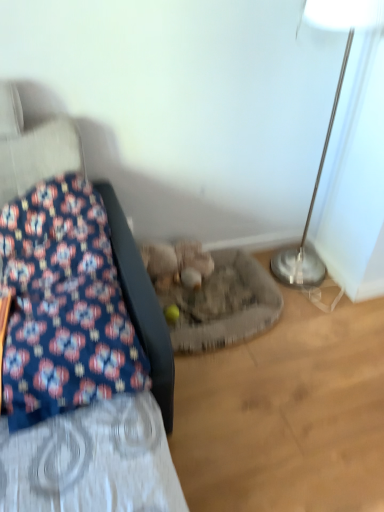
I want to click on fluffy beige stuffed animal at center, so click(177, 263).

From a real-world perspective, who is located lower, fluffy beige stuffed animal at center or blue floral fabric at left?

From a 3D spatial view, fluffy beige stuffed animal at center is below.

Is blue floral fabric at left located within fluffy beige stuffed animal at center?

No, blue floral fabric at left is not a part of fluffy beige stuffed animal at center.

Which of these two, fluffy beige stuffed animal at center or blue floral fabric at left, is wider?

Wider between the two is blue floral fabric at left.

Could you tell me if fluffy beige stuffed animal at center is turned towards blue floral fabric at left?

No, fluffy beige stuffed animal at center is not turned towards blue floral fabric at left.

Which object is positioned more to the right, fluffy beige stuffed animal at center or silver metallic floor lamp at right?

From the viewer's perspective, silver metallic floor lamp at right appears more on the right side.

Who is smaller, fluffy beige stuffed animal at center or silver metallic floor lamp at right?

Smaller between the two is fluffy beige stuffed animal at center.

Is fluffy beige stuffed animal at center not near silver metallic floor lamp at right?

Actually, fluffy beige stuffed animal at center and silver metallic floor lamp at right are a little close together.

From the image's perspective, does fluffy beige stuffed animal at center appear higher than silver metallic floor lamp at right?

No, from the image's perspective, fluffy beige stuffed animal at center is not over silver metallic floor lamp at right.

Where is `lamp above the blue floral fabric at left (from a real-world perspective)`? The image size is (384, 512). lamp above the blue floral fabric at left (from a real-world perspective) is located at coordinates (328, 124).

How many degrees apart are the facing directions of blue floral fabric at left and silver metallic floor lamp at right?

They differ by 91 degrees in their facing directions.

Who is smaller, blue floral fabric at left or silver metallic floor lamp at right?

With smaller size is blue floral fabric at left.

In the scene shown: From the image's perspective, is blue floral fabric at left positioned above or below silver metallic floor lamp at right?

From the image's perspective, blue floral fabric at left appears below silver metallic floor lamp at right.

Image resolution: width=384 pixels, height=512 pixels. I want to click on furniture that is on the left side of fluffy beige stuffed animal at center, so click(x=142, y=306).

From the image's perspective, which is above, blue floral fabric at left or fluffy beige stuffed animal at center?

fluffy beige stuffed animal at center appears higher in the image.

From the image's perspective, is silver metallic floor lamp at right on fluffy beige stuffed animal at center?

Yes, from the image's perspective, silver metallic floor lamp at right is over fluffy beige stuffed animal at center.

Locate an element on the screen. The height and width of the screenshot is (512, 384). lamp on the right side of fluffy beige stuffed animal at center is located at coordinates (328, 124).

Based on the photo, considering the sizes of objects silver metallic floor lamp at right and fluffy beige stuffed animal at center in the image provided, who is shorter, silver metallic floor lamp at right or fluffy beige stuffed animal at center?

fluffy beige stuffed animal at center.

Is silver metallic floor lamp at right further to the viewer compared to fluffy beige stuffed animal at center?

No, silver metallic floor lamp at right is closer to the viewer.

Could you tell me if silver metallic floor lamp at right is facing blue floral fabric at left?

Yes, silver metallic floor lamp at right is turned towards blue floral fabric at left.

Does point (304, 13) lie in front of point (164, 390)?

No.

Would you say silver metallic floor lamp at right is outside blue floral fabric at left?

Yes.

Consider the image. Can you confirm if silver metallic floor lamp at right is shorter than blue floral fabric at left?

No, silver metallic floor lamp at right is not shorter than blue floral fabric at left.

The image size is (384, 512). There is a fluffy beige stuffed animal at center. Find the location of `furniture above it (from a real-world perspective)`. furniture above it (from a real-world perspective) is located at coordinates (142, 306).

The width and height of the screenshot is (384, 512). I want to click on animal behind the silver metallic floor lamp at right, so pyautogui.click(x=177, y=263).

When comparing their distances from silver metallic floor lamp at right, does blue floral fabric at left or fluffy beige stuffed animal at center seem further?

Based on the image, blue floral fabric at left appears to be further to silver metallic floor lamp at right.

Looking at this image, looking at the image, which one is located further to fluffy beige stuffed animal at center, silver metallic floor lamp at right or blue floral fabric at left?

The object further to fluffy beige stuffed animal at center is silver metallic floor lamp at right.

When comparing their distances from silver metallic floor lamp at right, does fluffy beige stuffed animal at center or blue floral fabric at left seem further?

blue floral fabric at left lies further to silver metallic floor lamp at right than the other object.

Considering their positions, is fluffy beige stuffed animal at center positioned further to blue floral fabric at left than silver metallic floor lamp at right?

silver metallic floor lamp at right is positioned further to the anchor blue floral fabric at left.

Based on their spatial positions, is silver metallic floor lamp at right or fluffy beige stuffed animal at center further from blue floral fabric at left?

Based on the image, silver metallic floor lamp at right appears to be further to blue floral fabric at left.

Consider the image. From the image, which object appears to be nearer to fluffy beige stuffed animal at center, blue floral fabric at left or silver metallic floor lamp at right?

blue floral fabric at left.

What are the coordinates of `lamp located between blue floral fabric at left and fluffy beige stuffed animal at center in the depth direction` in the screenshot? It's located at (328, 124).